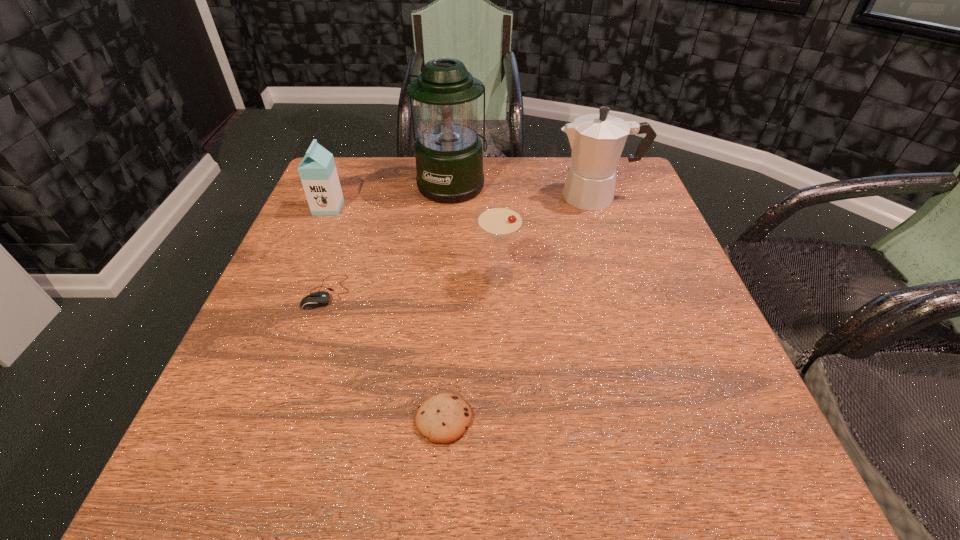
Find the location of `free space between the tallest object and the rightmost object`. free space between the tallest object and the rightmost object is located at coordinates (524, 190).

Select which object appears as the fifth closest to the computer mouse. Please provide its 2D coordinates. Your answer should be formatted as a tuple, i.e. [(x, y)], where the tuple contains the x and y coordinates of a point satisfying the conditions above.

[(597, 140)]

Identify the location of the fifth closest object to the rightmost object. The image size is (960, 540). (443, 418).

Identify the location of vacant region that satisfies the following two spatial constraints: 1. on the front side of the tallest object; 2. on the left side of the martini. The image size is (960, 540). (444, 276).

The image size is (960, 540). Find the location of `free region that satisfies the following two spatial constraints: 1. on the back side of the computer mouse; 2. on the left side of the tallest object`. free region that satisfies the following two spatial constraints: 1. on the back side of the computer mouse; 2. on the left side of the tallest object is located at coordinates (365, 184).